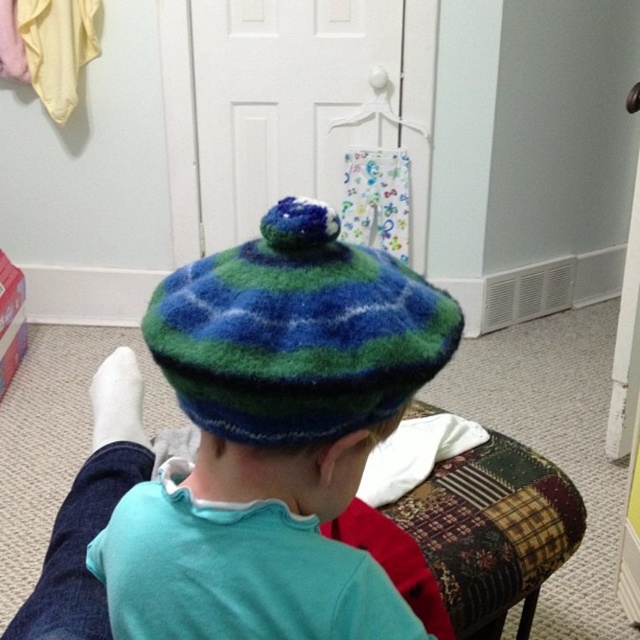
Question: Considering the real-world distances, which object is farthest from the white plastic hanger at upper center?

Choices:
 (A) multicolored fuzzy beret at center
 (B) multicolored knitted hat at center

Answer: (A)

Question: Does multicolored fuzzy beret at center appear on the left side of white plastic hanger at upper center?

Choices:
 (A) yes
 (B) no

Answer: (A)

Question: Can you confirm if multicolored knitted hat at center is positioned to the left of patchwork fabric stool at center?

Choices:
 (A) yes
 (B) no

Answer: (A)

Question: Which object is positioned farthest from the multicolored knitted hat at center?

Choices:
 (A) patchwork fabric stool at center
 (B) multicolored fuzzy beret at center

Answer: (A)

Question: Is multicolored knitted hat at center bigger than white plastic hanger at upper center?

Choices:
 (A) yes
 (B) no

Answer: (B)

Question: Which point appears farthest from the camera in this image?

Choices:
 (A) (481, 518)
 (B) (310, 317)

Answer: (A)